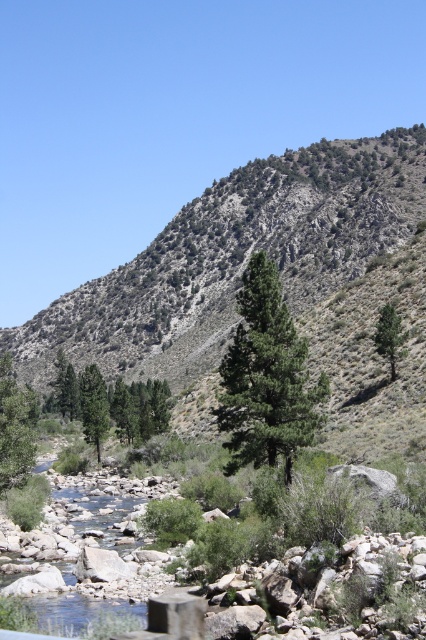
Who is more distant from viewer, [270,424] or [103,417]?

Positioned behind is point [103,417].

Is green matte tree at center shorter than green matte tree at center-left?

No.

The height and width of the screenshot is (640, 426). What do you see at coordinates (265, 378) in the screenshot?
I see `green matte tree at center` at bounding box center [265, 378].

You are a GUI agent. You are given a task and a screenshot of the screen. Output one action in this format:
    pyautogui.click(x=<x>, y=<y>)
    Task: Click on the green matte tree at center
    The image size is (426, 640).
    Given the screenshot: What is the action you would take?
    pyautogui.click(x=265, y=378)

Between point (104, 428) and point (388, 340), which one is positioned behind?

The point (104, 428) is behind.

Does green matte tree at center-left have a lesser width compared to green textured pine at center-right?

No.

Find the location of a particular element. Image resolution: width=426 pixels, height=640 pixels. green matte tree at center-left is located at coordinates (94, 404).

In the scene shown: Who is lower down, clear water at center or green matte tree at center?

A: clear water at center is lower down.

Does clear water at center have a lesser height compared to green matte tree at center?

Correct, clear water at center is not as tall as green matte tree at center.

Is point (74, 481) positioned before point (244, 410)?

No.

Where is `clear water at center`? The image size is (426, 640). clear water at center is located at coordinates (89, 556).